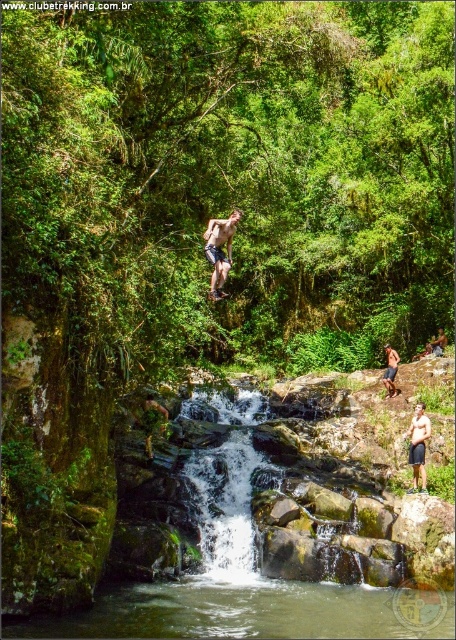
Looking at this image, which is above, skinny white man at lower right or tan skin human at center?

tan skin human at center is higher up.

Does point (408, 433) come behind point (389, 388)?

No, it is not.

Who is more distant from viewer, (x=419, y=451) or (x=393, y=374)?

The point (x=393, y=374) is behind.

Where is `skinny white man at lower right`? skinny white man at lower right is located at coordinates (418, 445).

Which is in front, point (153, 614) or point (414, 420)?

Point (153, 614) is more forward.

Based on the photo, is green mossy rocks at center below skinny white man at lower right?

Yes.

Locate an element on the screen. green mossy rocks at center is located at coordinates (241, 589).

Is shiny metallic shorts at center taller than smooth skin man at center?

Yes, shiny metallic shorts at center is taller than smooth skin man at center.

Can you confirm if shiny metallic shorts at center is thinner than smooth skin man at center?

In fact, shiny metallic shorts at center might be wider than smooth skin man at center.

Who is more forward, (224,259) or (445,339)?

Point (224,259) is more forward.

Where is `shiny metallic shorts at center`? shiny metallic shorts at center is located at coordinates (219, 250).